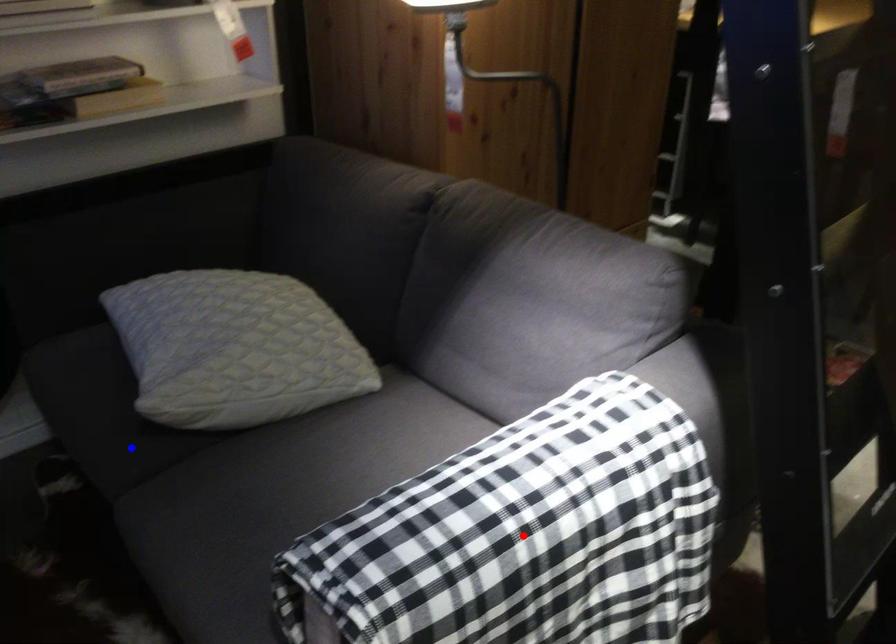
Question: Two points are marked on the image. Which point is closer to the camera?

Choices:
 (A) Blue point is closer.
 (B) Red point is closer.

Answer: (B)